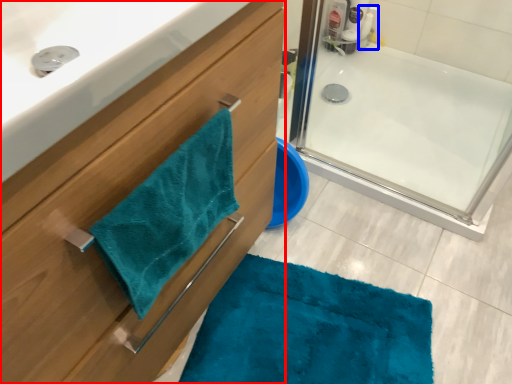
Question: Which object appears farthest to the camera in this image, bathroom cabinet (highlighted by a red box) or cleaning product (highlighted by a blue box)?

Choices:
 (A) bathroom cabinet
 (B) cleaning product

Answer: (B)